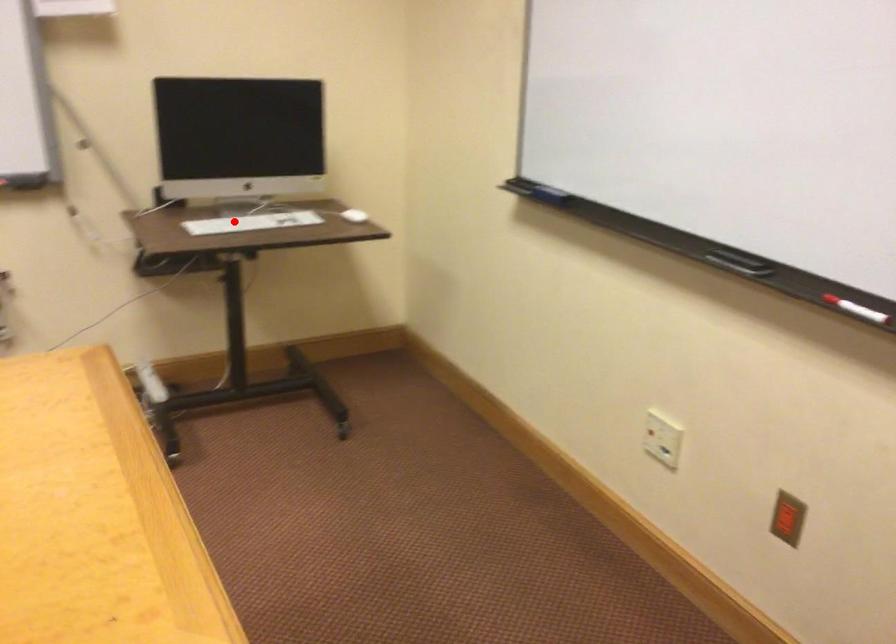
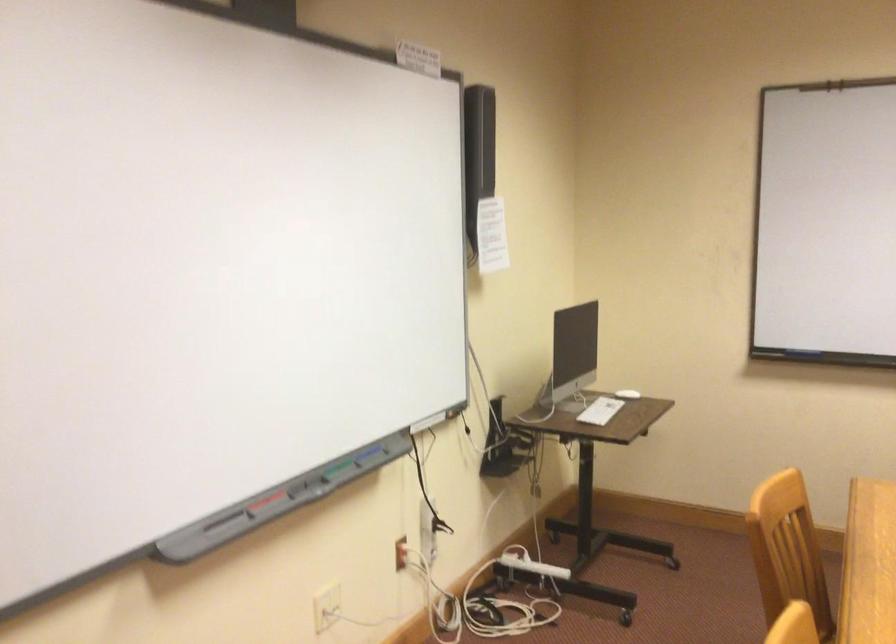
Question: I am providing you with two images of the same scene from different viewpoints. In image1, a red point is highlighted. Considering the same 3D point in image2, which of the following is correct?

Choices:
 (A) It is closer
 (B) It is farther

Answer: (B)